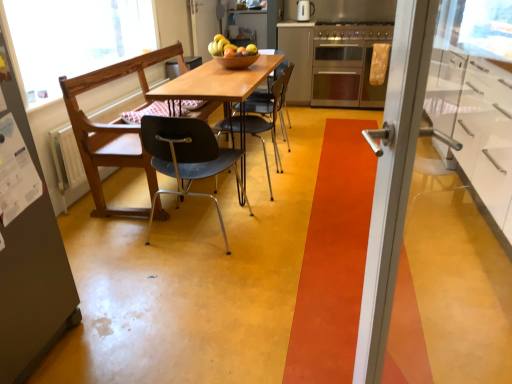
This screenshot has width=512, height=384. Find the location of `free space to the right of matte black chair at center, the first chair positioned from the front`. free space to the right of matte black chair at center, the first chair positioned from the front is located at coordinates (286, 226).